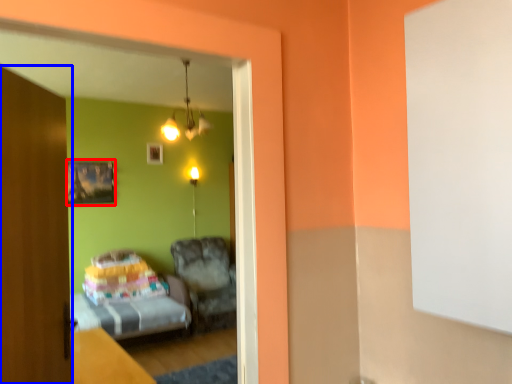
Question: Among these objects, which one is farthest to the camera, picture frame (highlighted by a red box) or door (highlighted by a blue box)?

Choices:
 (A) picture frame
 (B) door

Answer: (A)